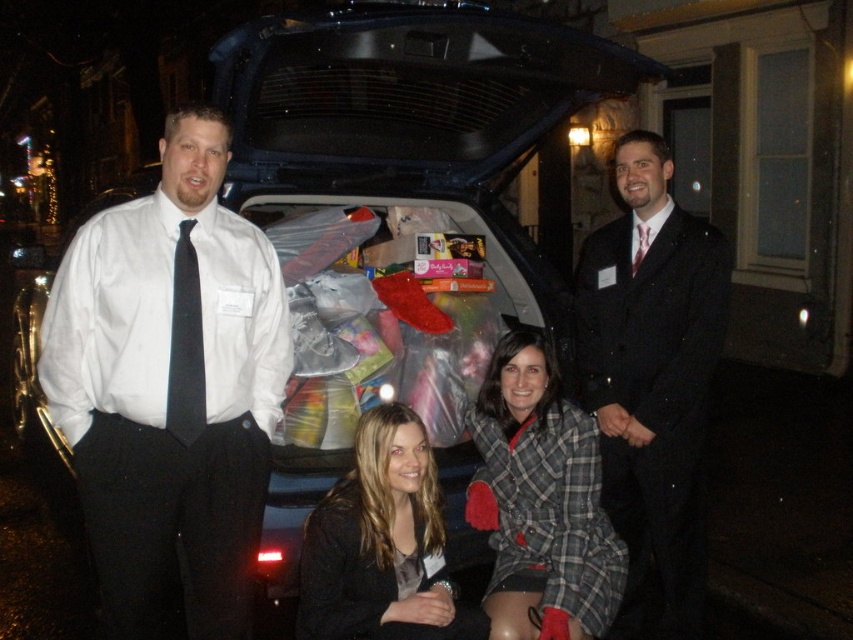
Describe the element at coordinates (540, 500) in the screenshot. The height and width of the screenshot is (640, 853). I see `plaid wool coat at lower center` at that location.

Is point (567, 612) positioned before point (380, 525)?

No, it is not.

Between point (592, 611) and point (370, 448), which one is positioned behind?

Point (592, 611)

Image resolution: width=853 pixels, height=640 pixels. Find the location of `plaid wool coat at lower center`. plaid wool coat at lower center is located at coordinates (540, 500).

Between plaid wool coat at lower center and black satin tie at left, which one appears on the right side from the viewer's perspective?

plaid wool coat at lower center

Between point (554, 614) and point (175, 387), which one is positioned in front?

Point (175, 387) is more forward.

Which is behind, point (582, 448) or point (181, 413)?

Positioned behind is point (582, 448).

Locate an element on the screen. The image size is (853, 640). plaid wool coat at lower center is located at coordinates (540, 500).

Is point (97, 483) positioned before point (595, 524)?

Yes, it is in front of point (595, 524).

Can you confirm if white shirt at left is positioned below plaid wool coat at lower center?

Incorrect, white shirt at left is not positioned below plaid wool coat at lower center.

Which is in front, point (115, 224) or point (520, 387)?

Point (115, 224)

Identify the location of white shirt at left. (170, 388).